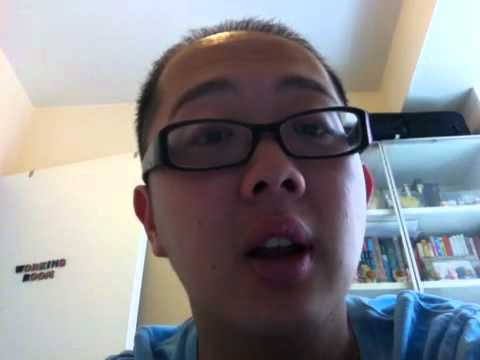
Where is `walls`? The height and width of the screenshot is (360, 480). walls is located at coordinates click(78, 134), click(4, 113).